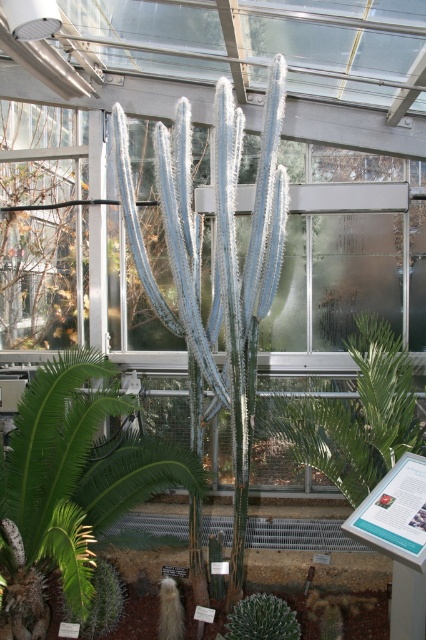
Question: Does green leafy plant at center lie in front of green spiky cactus at lower left?

Choices:
 (A) yes
 (B) no

Answer: (B)

Question: Does green spiky cactus at center come behind green spiky cactus at lower left?

Choices:
 (A) no
 (B) yes

Answer: (A)

Question: Which point appears farthest from the camera in this image?

Choices:
 (A) (371, 342)
 (B) (97, 632)
 (C) (23, 627)
 (D) (247, 630)

Answer: (A)

Question: Is green spiky cactus at center to the right of green spiky cactus at lower left from the viewer's perspective?

Choices:
 (A) yes
 (B) no

Answer: (A)

Question: Estimate the real-world distances between objects in this image. Which object is farther from the green spiky cactus at center?

Choices:
 (A) green fuzzy cactus at center
 (B) green spiky cactus at lower left

Answer: (A)

Question: Which point is farther to the camera?

Choices:
 (A) green spiky cactus at lower left
 (B) green fuzzy cactus at center
 (C) green spiky cactus at center

Answer: (A)